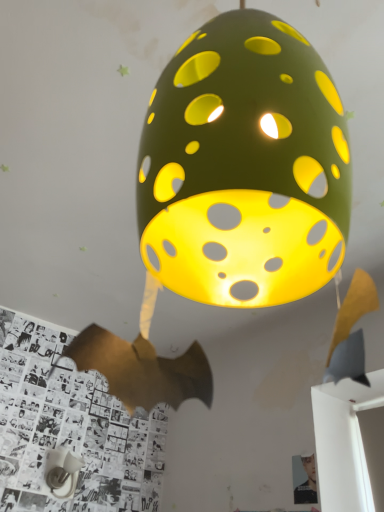
Question: Does smooth black portrait at lower right have a larger size compared to white matte table lamp at lower left?

Choices:
 (A) yes
 (B) no

Answer: (B)

Question: From a real-world perspective, does smooth black portrait at lower right stand above white matte table lamp at lower left?

Choices:
 (A) yes
 (B) no

Answer: (B)

Question: From the image's perspective, would you say smooth black portrait at lower right is shown under white matte table lamp at lower left?

Choices:
 (A) yes
 (B) no

Answer: (B)

Question: Would you say smooth black portrait at lower right is outside white matte table lamp at lower left?

Choices:
 (A) yes
 (B) no

Answer: (A)

Question: Can you confirm if smooth black portrait at lower right is wider than white matte table lamp at lower left?

Choices:
 (A) yes
 (B) no

Answer: (B)

Question: Is smooth black portrait at lower right taller than white matte table lamp at lower left?

Choices:
 (A) yes
 (B) no

Answer: (A)

Question: Is white matte table lamp at lower left far away from smooth black portrait at lower right?

Choices:
 (A) no
 (B) yes

Answer: (A)

Question: Is white matte table lamp at lower left thinner than smooth black portrait at lower right?

Choices:
 (A) no
 (B) yes

Answer: (A)

Question: Are white matte table lamp at lower left and smooth black portrait at lower right beside each other?

Choices:
 (A) no
 (B) yes

Answer: (A)

Question: From a real-world perspective, is white matte table lamp at lower left below smooth black portrait at lower right?

Choices:
 (A) yes
 (B) no

Answer: (B)

Question: Is white matte table lamp at lower left not within smooth black portrait at lower right?

Choices:
 (A) no
 (B) yes

Answer: (B)

Question: Considering the relative positions of white matte table lamp at lower left and smooth black portrait at lower right in the image provided, is white matte table lamp at lower left to the left of smooth black portrait at lower right from the viewer's perspective?

Choices:
 (A) yes
 (B) no

Answer: (A)

Question: Is white matte table lamp at lower left in front of or behind smooth black portrait at lower right in the image?

Choices:
 (A) behind
 (B) front

Answer: (A)